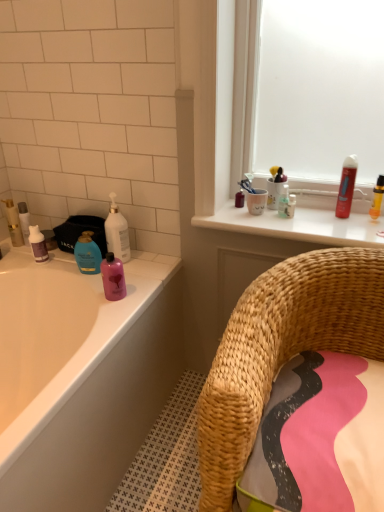
Where is `free space above white glossy counter top at upper center (from a real-world perspective)`? free space above white glossy counter top at upper center (from a real-world perspective) is located at coordinates (297, 217).